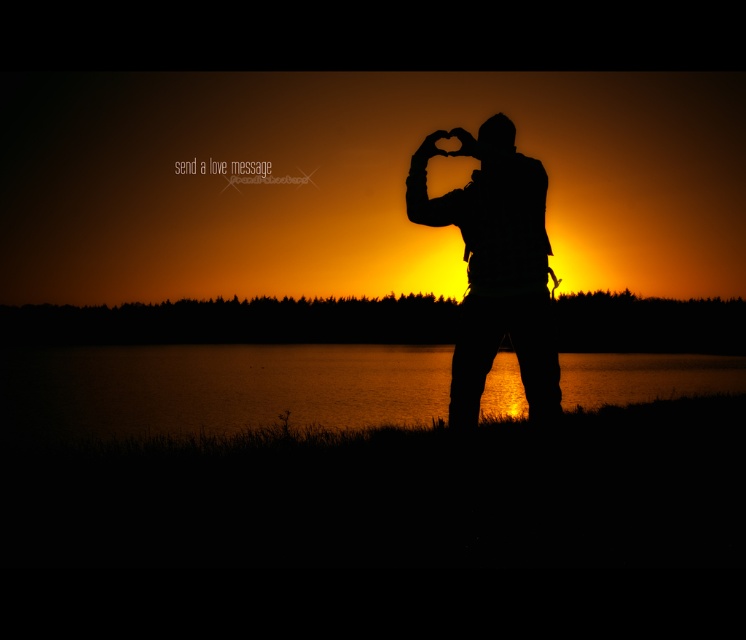
Is glistening water at center below silhouette figure at center?

Correct, glistening water at center is located below silhouette figure at center.

Which of these two, glistening water at center or silhouette figure at center, stands taller?

glistening water at center is taller.

Is point (22, 419) positioned before point (468, 314)?

No, (22, 419) is behind (468, 314).

This screenshot has width=746, height=640. I want to click on glistening water at center, so click(213, 388).